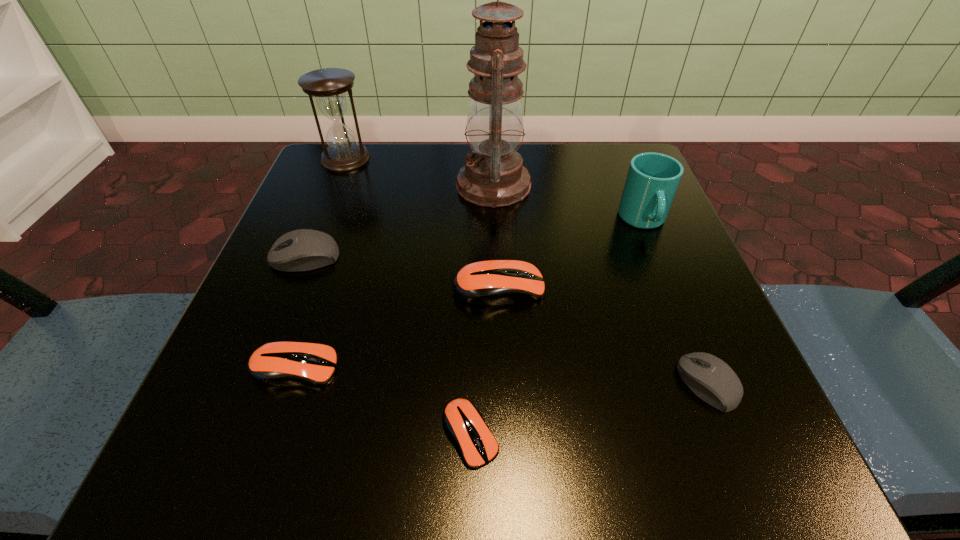
The width and height of the screenshot is (960, 540). Identify the location of the shortest object. (462, 419).

I want to click on the nearest orange computer mouse, so click(462, 419).

Find the location of a particular element. free space located 0.200m on the left of the tallest object is located at coordinates (360, 185).

Where is `vacant space located 0.340m on the front of the second tallest object`? vacant space located 0.340m on the front of the second tallest object is located at coordinates (295, 287).

At what (x,y) coordinates should I click in order to perform the action: click on blank area located on the handle side of the third tallest object. Please return your answer as a coordinate pair (x, y). The width and height of the screenshot is (960, 540). Looking at the image, I should click on (707, 376).

Image resolution: width=960 pixels, height=540 pixels. Identify the location of vacant space located on the right of the biggest orange computer mouse. (691, 288).

At what (x,y) coordinates should I click in order to perform the action: click on free spot located on the right of the farther black computer equipment. Please return your answer as a coordinate pair (x, y). The width and height of the screenshot is (960, 540). Looking at the image, I should click on (407, 257).

The width and height of the screenshot is (960, 540). What are the coordinates of `vacant space located 0.170m on the right of the second farthest orange computer mouse` in the screenshot? It's located at (459, 368).

Locate an element on the screen. free space located on the front of the smaller black computer equipment is located at coordinates (735, 451).

Where is `free space located 0.130m on the right of the nearest orange computer mouse`? The image size is (960, 540). free space located 0.130m on the right of the nearest orange computer mouse is located at coordinates (603, 434).